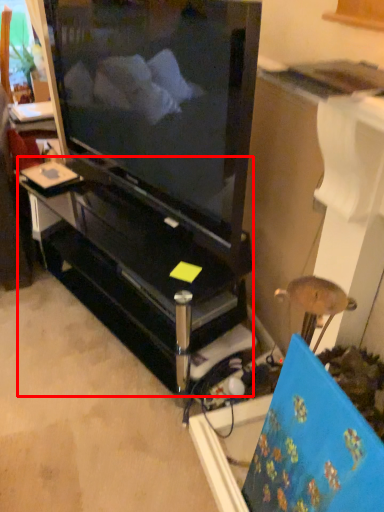
Question: From the image's perspective, what is the correct spatial relationship of furniture (annotated by the red box) in relation to television?

Choices:
 (A) below
 (B) above

Answer: (A)